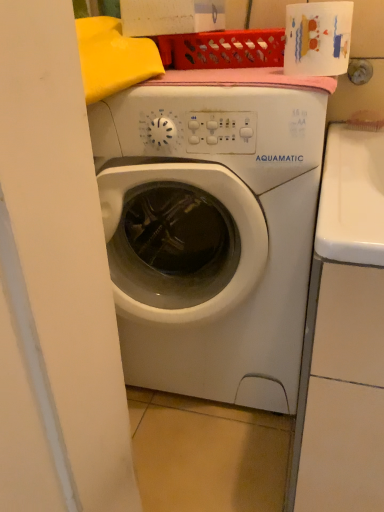
Find the location of a particular element. Image resolution: width=384 pixels, height=512 pixels. free space to the left of white glossy toilet paper at upper right is located at coordinates (219, 83).